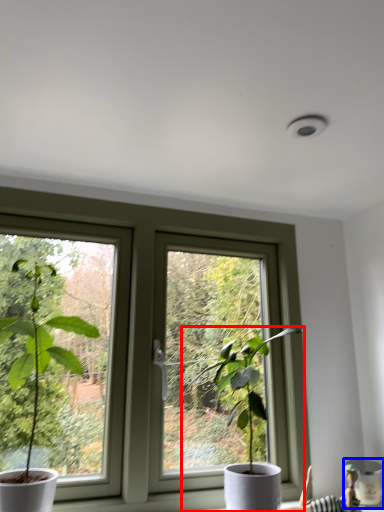
Question: Which point is further to the camera, houseplant (highlighted by a red box) or vase (highlighted by a blue box)?

Choices:
 (A) houseplant
 (B) vase

Answer: (B)